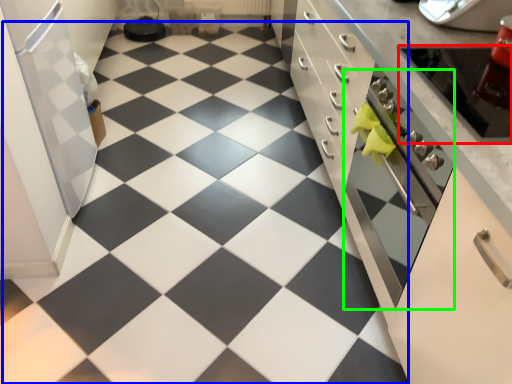
Question: Which object is positioned closest to appliance (highlighted by a red box)? Select from tile (highlighted by a blue box) and oven (highlighted by a green box).

Choices:
 (A) tile
 (B) oven

Answer: (B)